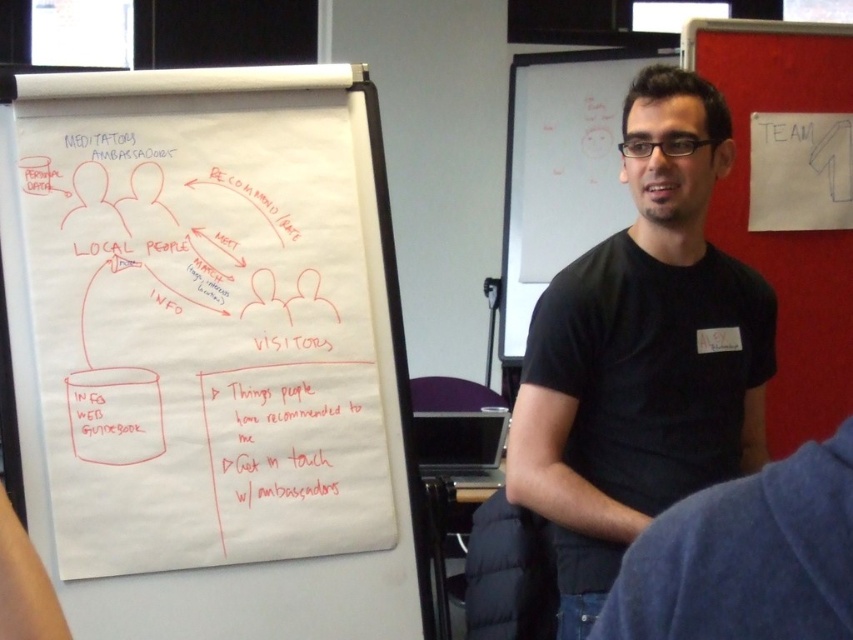
From the picture: Can you confirm if white paper at left is shorter than red fabric bulletin board at upper right?

No, white paper at left is not shorter than red fabric bulletin board at upper right.

Between point (51, 161) and point (747, 150), which one is positioned behind?

Positioned behind is point (747, 150).

What are the coordinates of `white paper at left` in the screenshot? It's located at (210, 353).

The height and width of the screenshot is (640, 853). I want to click on white paper at left, so click(x=210, y=353).

Can you confirm if white paper at left is bigger than black matte t-shirt at center?

No, white paper at left is not bigger than black matte t-shirt at center.

Who is positioned more to the left, white paper at left or black matte t-shirt at center?

From the viewer's perspective, white paper at left appears more on the left side.

Between point (334, 490) and point (579, 541), which one is positioned behind?

Point (334, 490)

Find the location of a particular element. This screenshot has width=853, height=640. white paper at left is located at coordinates (210, 353).

Between point (657, 236) and point (749, 115), which one is positioned in front?

Point (657, 236)

Does black matte t-shirt at center have a smaller size compared to red fabric bulletin board at upper right?

Actually, black matte t-shirt at center might be larger than red fabric bulletin board at upper right.

The image size is (853, 640). What are the coordinates of `black matte t-shirt at center` in the screenshot? It's located at (642, 353).